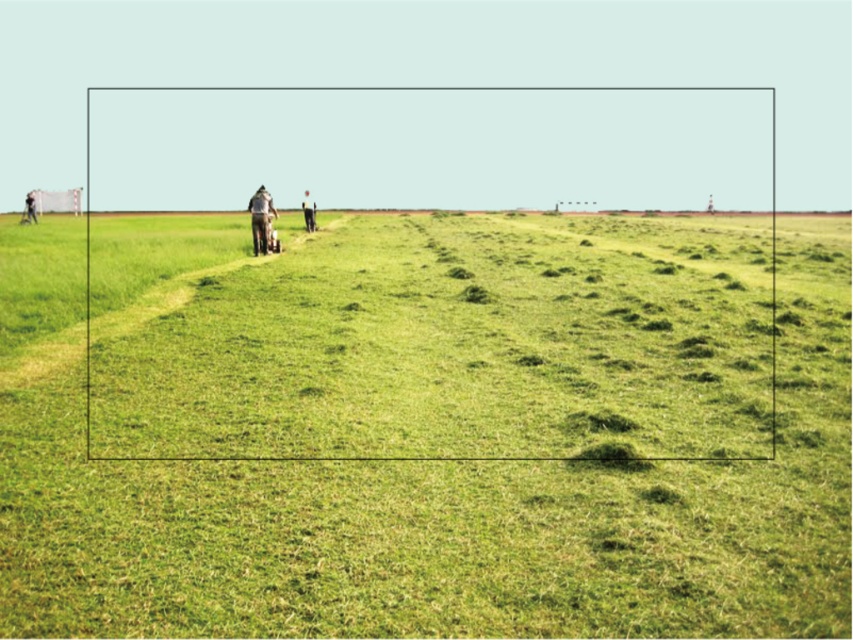
Does point (260, 212) come in front of point (32, 208)?

Yes.

Does point (254, 209) come behind point (32, 204)?

No, (254, 209) is closer to viewer.

Locate an element on the screen. The image size is (853, 640). dark gray fabric jacket at center is located at coordinates (260, 220).

Is green grass at center closer to the viewer compared to smooth skin person at left?

Yes, it is in front of smooth skin person at left.

Does point (256, 480) come closer to viewer compared to point (35, 221)?

Yes, point (256, 480) is in front of point (35, 221).

Does point (62, 465) come farther from viewer compared to point (26, 202)?

No, it is in front of (26, 202).

Find the location of a particular element. The height and width of the screenshot is (640, 853). green grass at center is located at coordinates (442, 518).

Where is `green grass at center`? The width and height of the screenshot is (853, 640). green grass at center is located at coordinates (442, 518).

Can you confirm if green grass at center is thinner than dark gray fabric jacket at center?

In fact, green grass at center might be wider than dark gray fabric jacket at center.

Is point (511, 598) behind point (252, 250)?

No.

The width and height of the screenshot is (853, 640). Identify the location of green grass at center. (442, 518).